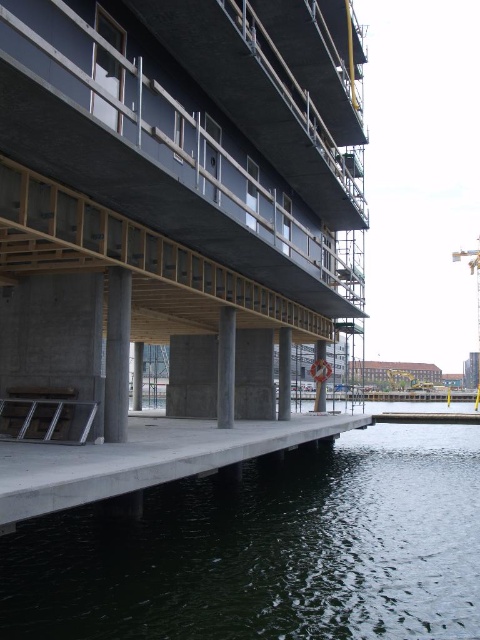
Is concrete/rough pillar at lower center to the right of concrete at lower center from the viewer's perspective?

In fact, concrete/rough pillar at lower center is to the left of concrete at lower center.

Does point (132, 392) come farther from viewer compared to point (324, 352)?

Yes.

Is point (137, 372) closer to viewer compared to point (324, 353)?

No.

Image resolution: width=480 pixels, height=640 pixels. In order to click on concrete/rough pillar at lower center in this screenshot , I will do `click(137, 376)`.

Does point (132, 484) lie in front of point (117, 412)?

Yes, it is in front of point (117, 412).

Is concrete at lower left below concrete/rough column at lower center?

Yes, concrete at lower left is below concrete/rough column at lower center.

Who is more forward, (164, 458) or (110, 301)?

Point (164, 458) is in front.

Image resolution: width=480 pixels, height=640 pixels. I want to click on concrete at lower left, so click(144, 458).

The image size is (480, 640). What do you see at coordinates (267, 550) in the screenshot?
I see `dark green concrete water at lower center` at bounding box center [267, 550].

Consider the image. Is dark green concrete water at lower center closer to camera compared to concrete at center?

That is True.

Which is in front, point (468, 474) or point (218, 362)?

Point (218, 362) is in front.

What are the coordinates of `dark green concrete water at lower center` in the screenshot? It's located at (267, 550).